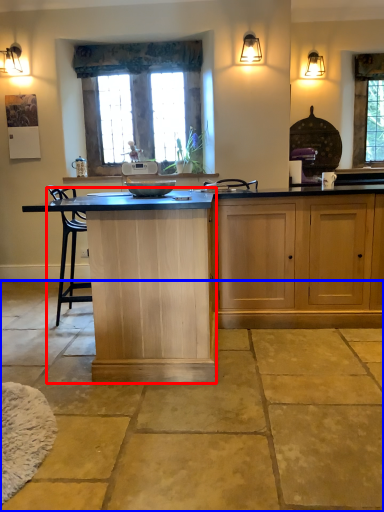
Question: Which object is further to the camera taking this photo, vanity (highlighted by a red box) or concrete (highlighted by a blue box)?

Choices:
 (A) vanity
 (B) concrete

Answer: (A)